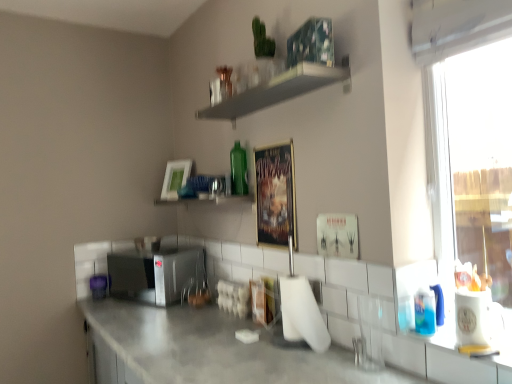
Question: Does transparent glass window at right touch green glass bottle at upper center, which is the 1th shelf from bottom to top?

Choices:
 (A) no
 (B) yes

Answer: (A)

Question: From the image's perspective, does transparent glass window at right appear higher than green glass bottle at upper center, the second shelf positioned from the top?

Choices:
 (A) yes
 (B) no

Answer: (A)

Question: Does transparent glass window at right have a lesser height compared to green glass bottle at upper center, the second shelf positioned from the top?

Choices:
 (A) yes
 (B) no

Answer: (B)

Question: Is transparent glass window at right facing away from green glass bottle at upper center, the second shelf positioned from the top?

Choices:
 (A) yes
 (B) no

Answer: (B)

Question: From a real-world perspective, does transparent glass window at right sit lower than green glass bottle at upper center, the second shelf positioned from the top?

Choices:
 (A) no
 (B) yes

Answer: (A)

Question: Is transparent glass window at right aimed at green glass bottle at upper center, the second shelf positioned from the top?

Choices:
 (A) yes
 (B) no

Answer: (B)

Question: Is the depth of green glass bottle at upper center greater than that of white matte picture frame at upper center, the second picture frame positioned from the front?

Choices:
 (A) yes
 (B) no

Answer: (B)

Question: From a real-world perspective, is green glass bottle at upper center on top of white matte picture frame at upper center, the 1th picture frame from the back?

Choices:
 (A) yes
 (B) no

Answer: (A)

Question: Is green glass bottle at upper center smaller than white matte picture frame at upper center, placed as the 1th picture frame when sorted from left to right?

Choices:
 (A) no
 (B) yes

Answer: (B)

Question: Is green glass bottle at upper center at the left side of white matte picture frame at upper center, the 1th picture frame from the back?

Choices:
 (A) yes
 (B) no

Answer: (B)

Question: Does green glass bottle at upper center have a lesser height compared to white matte picture frame at upper center, the second picture frame positioned from the front?

Choices:
 (A) yes
 (B) no

Answer: (A)

Question: Considering the relative sizes of green glass bottle at upper center and white matte picture frame at upper center, placed as the 1th picture frame when sorted from left to right, in the image provided, is green glass bottle at upper center bigger than white matte picture frame at upper center, placed as the 1th picture frame when sorted from left to right,?

Choices:
 (A) yes
 (B) no

Answer: (B)

Question: Can you confirm if metallic poster at center, arranged as the 1th picture frame when viewed from the right, is positioned to the left of white matte shelf at upper center, the 1th shelf when ordered from top to bottom?

Choices:
 (A) yes
 (B) no

Answer: (B)